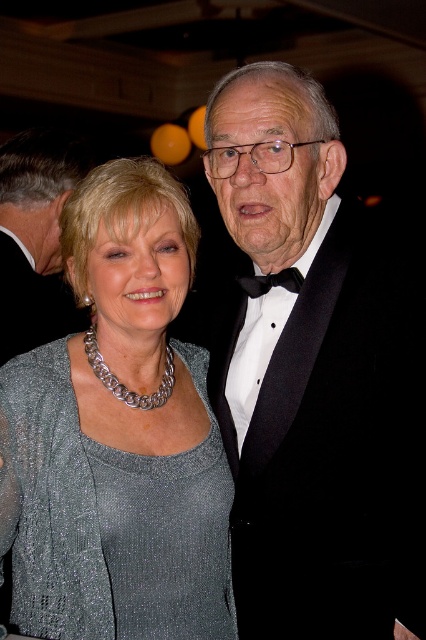
Who is taller, sparkly silver dress at center or black satin bow tie at upper right?

Standing taller between the two is sparkly silver dress at center.

Is sparkly silver dress at center smaller than black satin bow tie at upper right?

Actually, sparkly silver dress at center might be larger than black satin bow tie at upper right.

At what (x,y) coordinates should I click in order to perform the action: click on sparkly silver dress at center. Please return your answer as a coordinate pair (x, y). The width and height of the screenshot is (426, 640). Looking at the image, I should click on (118, 436).

Is sparkly silver dress at center closer to the viewer compared to black satin bow tie at center?

Yes, sparkly silver dress at center is closer to the viewer.

Who is shorter, sparkly silver dress at center or black satin bow tie at center?

Standing shorter between the two is black satin bow tie at center.

I want to click on sparkly silver dress at center, so click(x=118, y=436).

Can you confirm if black satin bow tie at upper right is shorter than black satin bow tie at center?

No.

Is black satin bow tie at upper right above black satin bow tie at center?

Indeed, black satin bow tie at upper right is positioned over black satin bow tie at center.

Who is more distant from viewer, [25,220] or [294,291]?

The point [25,220] is behind.

At what (x,y) coordinates should I click in order to perform the action: click on black satin bow tie at upper right. Please return your answer as a coordinate pair (x, y). Image resolution: width=426 pixels, height=640 pixels. Looking at the image, I should click on (32, 228).